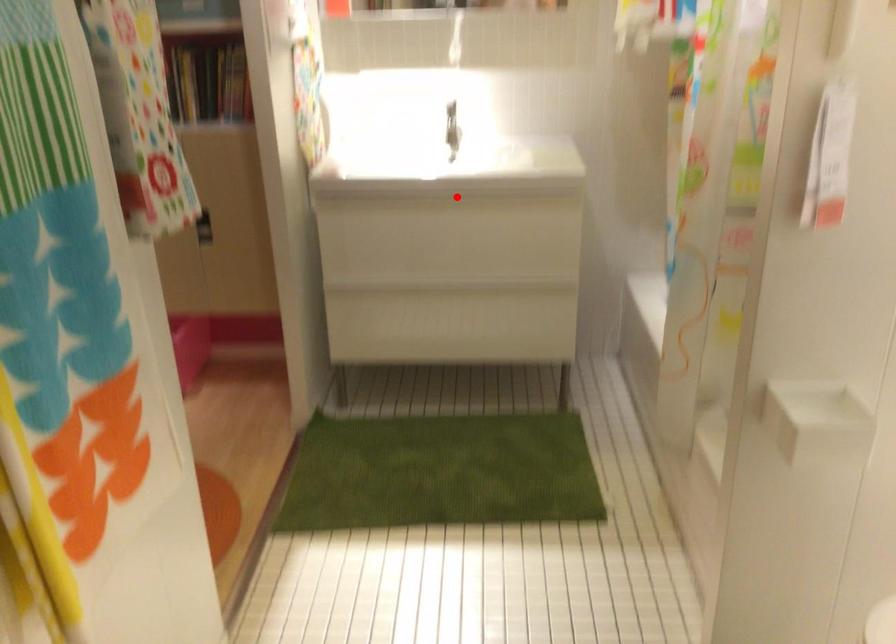
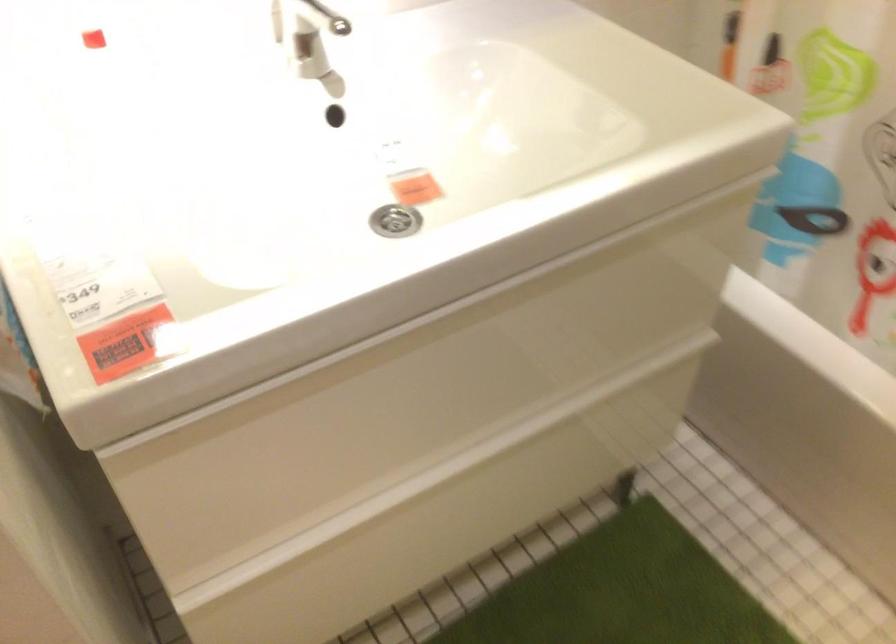
Question: A red point is marked in image1. In image2, is the corresponding 3D point closer to the camera or farther? Reply with the corresponding letter.

Choices:
 (A) The corresponding 3D point is closer.
 (B) The corresponding 3D point is farther.

Answer: (A)